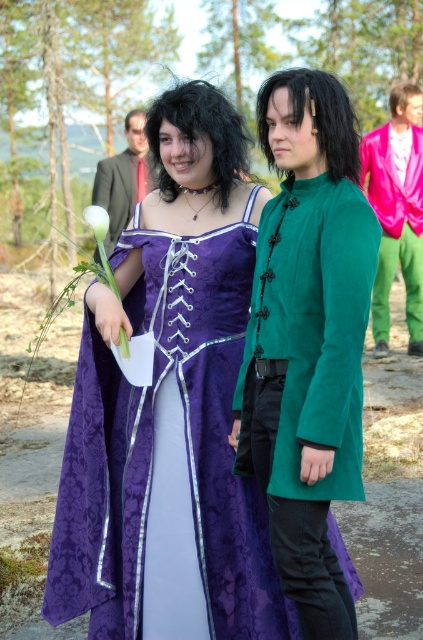
You are a photographer at this event and need to adjust the lighting so that the satin purple dress at center is fully visible without the purple satin dress at center blocking it. How should you position the lights?

The satin purple dress at center is in front of the purple satin dress at center. To ensure the front dress is fully visible, position the lights so they illuminate the satin purple dress at center directly while avoiding casting shadows from the front dress onto the one behind.

You are standing in the forest and see a point marked at coordinates (307,339). Based on the scene description, can you identify what object this point is located on?

The point at coordinates (307,339) is located on the satin purple dress at center.